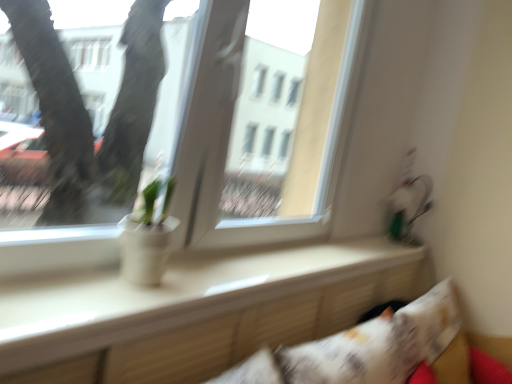
Where is `free space on the front side of white matte pot at center`? free space on the front side of white matte pot at center is located at coordinates (113, 300).